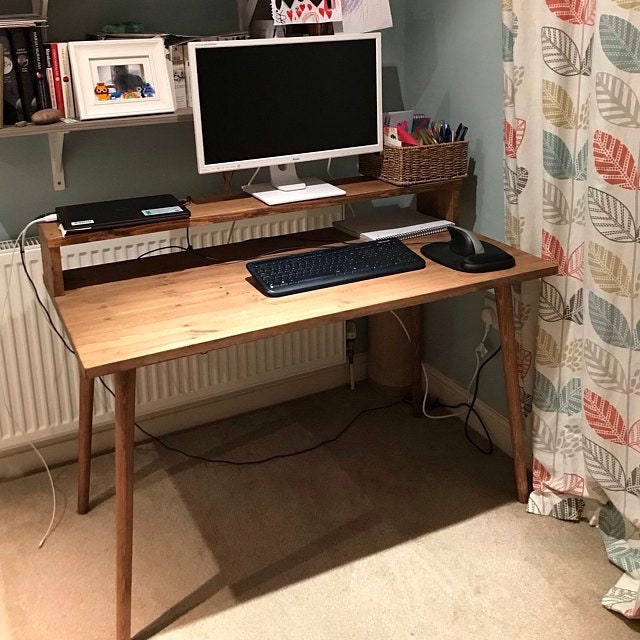
Where is `books`? books is located at coordinates (29, 67).